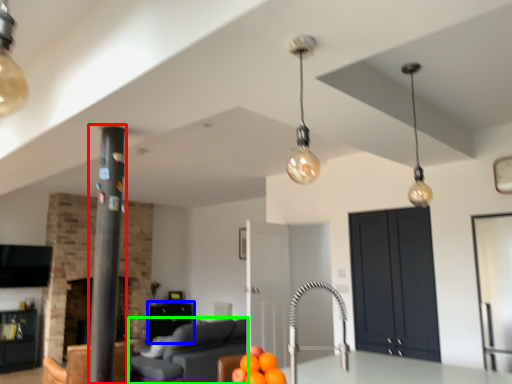
Question: Which object is positioned closest to pillar (highlighted by a red box)? Select from cabinetry (highlighted by a blue box) and furniture (highlighted by a green box).

Choices:
 (A) cabinetry
 (B) furniture

Answer: (B)